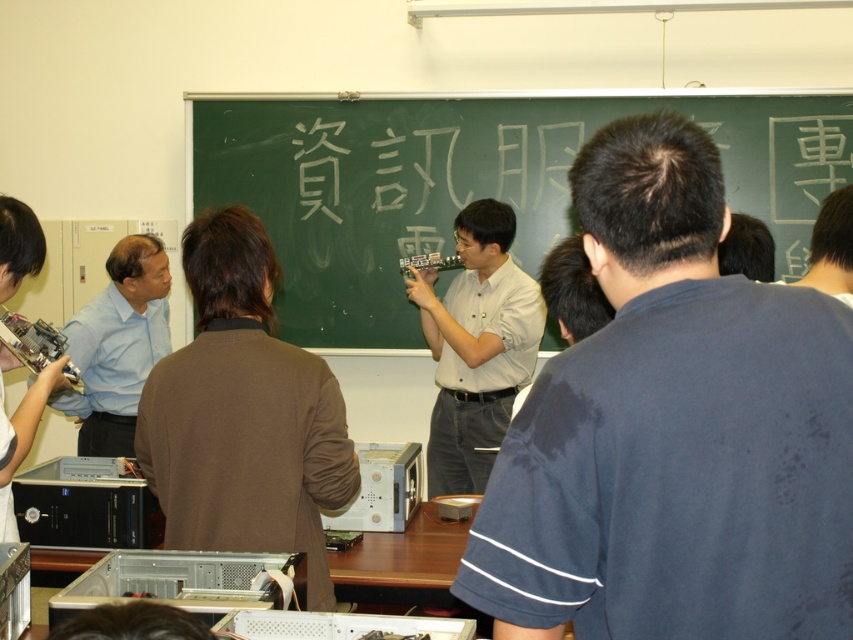
You are a student in the classroom. You need to write down the Chinese characters from the green chalkboard at center and the white chalk writing at center. Which object should you look at first if you want to copy the taller one?

The green chalkboard at center is taller than the white chalk writing at center, so you should look at the green chalkboard at center first to copy the taller one.

You are observing a classroom activity involving computer hardware. There are two people at the table, one wearing a white glossy shirt at center and another wearing a light blue shirt at left. From your perspective, which shirt is positioned lower?

The white glossy shirt at center is below the light blue shirt at left, so the white glossy shirt at center is positioned lower.